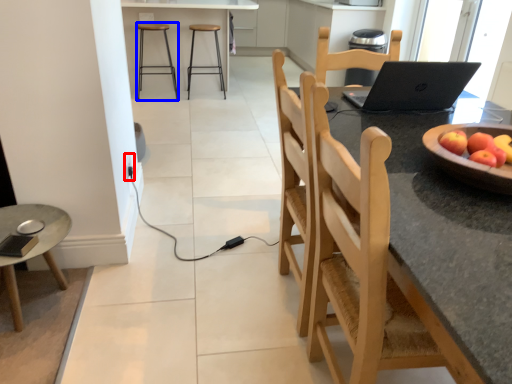
Question: Among these objects, which one is farthest to the camera, electric outlet (highlighted by a red box) or stool (highlighted by a blue box)?

Choices:
 (A) electric outlet
 (B) stool

Answer: (B)